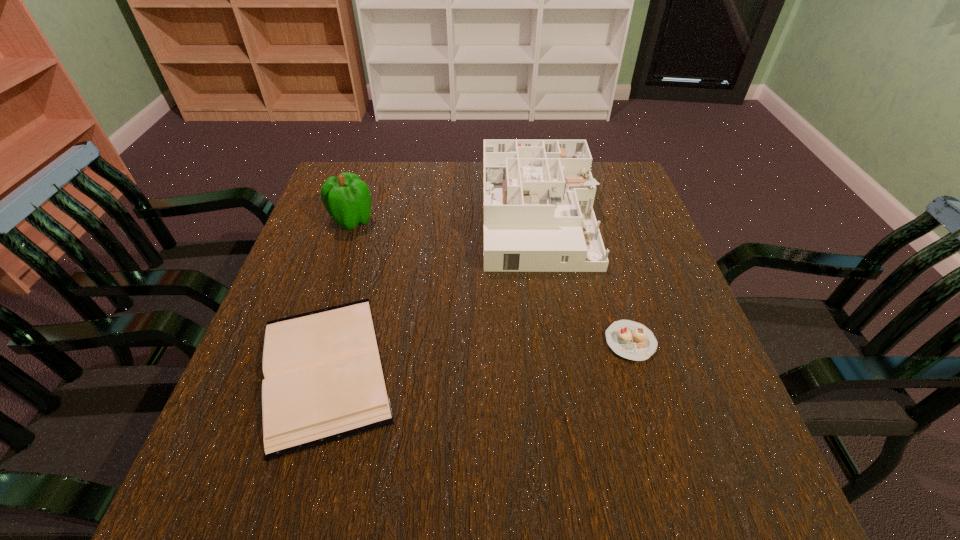
This screenshot has height=540, width=960. I want to click on bell pepper, so click(347, 198).

Identify the location of dollhouse. (538, 195).

Identify the location of cupcake. The height and width of the screenshot is (540, 960). (631, 340).

Where is `the shortest object`? The image size is (960, 540). the shortest object is located at coordinates (324, 381).

Where is `vacant region located 0.180m on the back of the bell pepper`? vacant region located 0.180m on the back of the bell pepper is located at coordinates (369, 172).

Identify the location of free space located on the front of the dollhouse. click(570, 423).

Locate an element on the screen. The width and height of the screenshot is (960, 540). free point located 0.190m on the left of the second shortest object is located at coordinates (512, 342).

In order to click on vacant region located 0.280m on the back of the hardback book in this screenshot , I will do `click(368, 222)`.

Image resolution: width=960 pixels, height=540 pixels. What are the coordinates of `bell pepper that is positioned at the far edge` in the screenshot? It's located at (347, 198).

Identify the location of dollhouse that is at the far edge. The width and height of the screenshot is (960, 540). (538, 195).